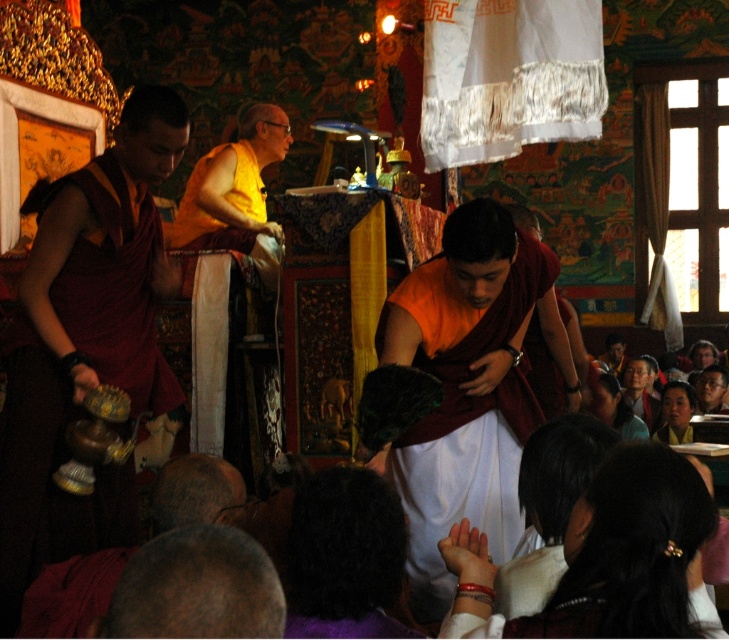
Is bald head at lower left shorter than dark brown leather hat at lower left?

Yes, bald head at lower left is shorter than dark brown leather hat at lower left.

Who is positioned more to the right, bald head at lower left or dark brown leather hat at lower left?

Positioned to the right is bald head at lower left.

Locate an element on the screen. The width and height of the screenshot is (729, 640). bald head at lower left is located at coordinates (195, 588).

The width and height of the screenshot is (729, 640). Describe the element at coordinates (464, 387) in the screenshot. I see `orange matte cloth at center` at that location.

Does point (477, 406) come farther from viewer compared to point (268, 240)?

No, (477, 406) is closer to viewer.

Identify the location of orange matte cloth at center. The height and width of the screenshot is (640, 729). (464, 387).

This screenshot has height=640, width=729. I want to click on orange matte cloth at center, so click(x=464, y=387).

Is yellow-orange robe at center smaller than dark brown leather hat at lower left?

Incorrect, yellow-orange robe at center is not smaller in size than dark brown leather hat at lower left.

The width and height of the screenshot is (729, 640). Identify the location of yellow-orange robe at center. (235, 195).

Where is `yellow-orange robe at center`? yellow-orange robe at center is located at coordinates (235, 195).